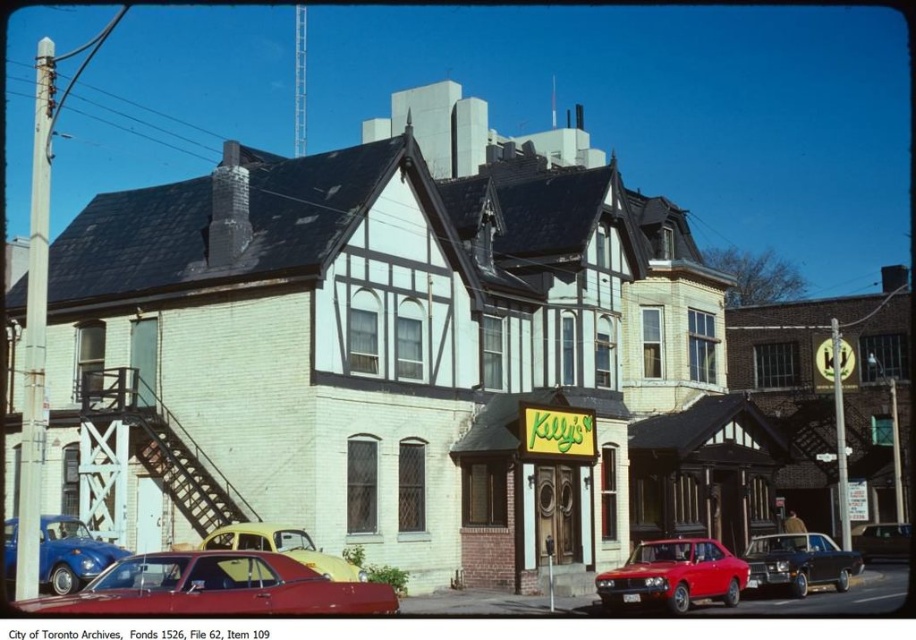
You are a delivery driver who needs to park your yellow matte car at center in a spot that won not block the yellow signboard at center. Given that the signboard is larger than the car, can you park the car without covering the signboard?

The yellow signboard at center is bigger than the yellow matte car at center, so yes, you can park the yellow matte car at center without covering the signboard since the car is smaller in size compared to the signboard.

Looking at this image, you are a pedestrian standing on the sidewalk and want to cross the street to reach the central building. There is a glossy red car at lower left and a shiny black sedan at center. Which car is closer to you as you stand on the sidewalk?

The glossy red car at lower left is closer to you because it is in front of the shiny black sedan at center, meaning it is positioned nearer to your location on the sidewalk.

You are a pedestrian standing at the crosswalk on the sidewalk opposite the buildings. You need to cross the street to reach the shiny black sedan at center. Which direction should you walk to avoid the glossy red car at lower left?

The glossy red car at lower left is to the left of the shiny black sedan at center, so you should walk to the right of the shiny black sedan at center to avoid the glossy red car at lower left.